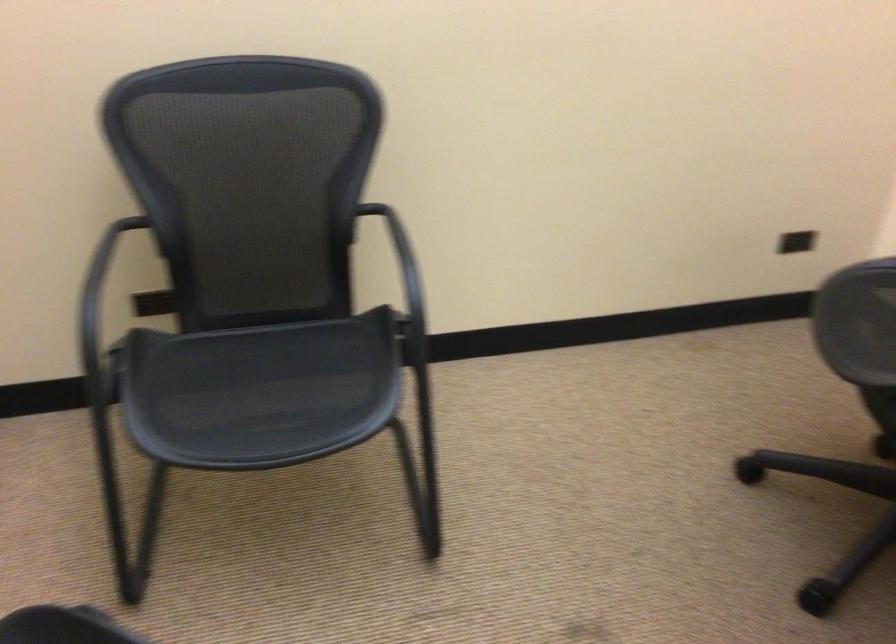
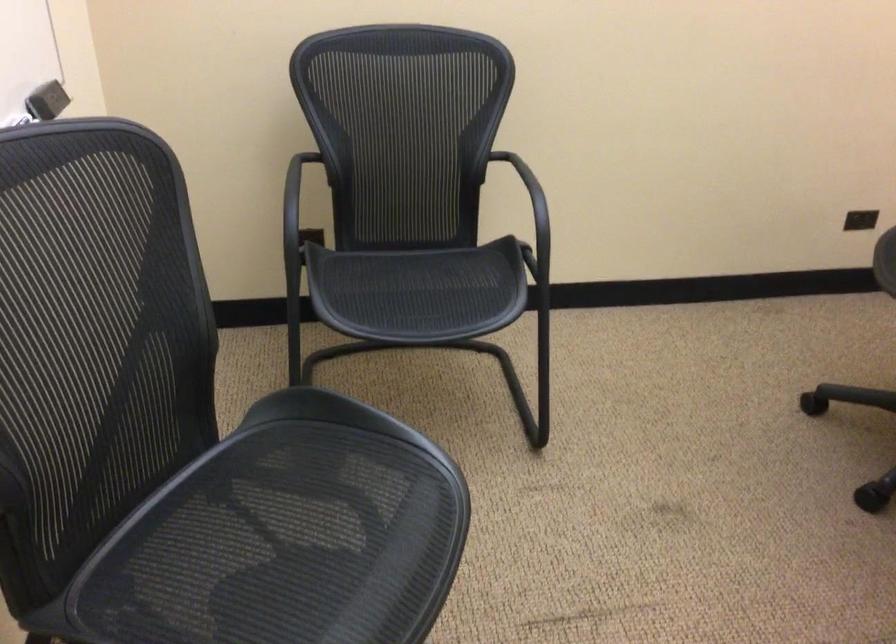
Locate, in the second image, the point that corresponds to point 255,384 in the first image.

(409, 287)